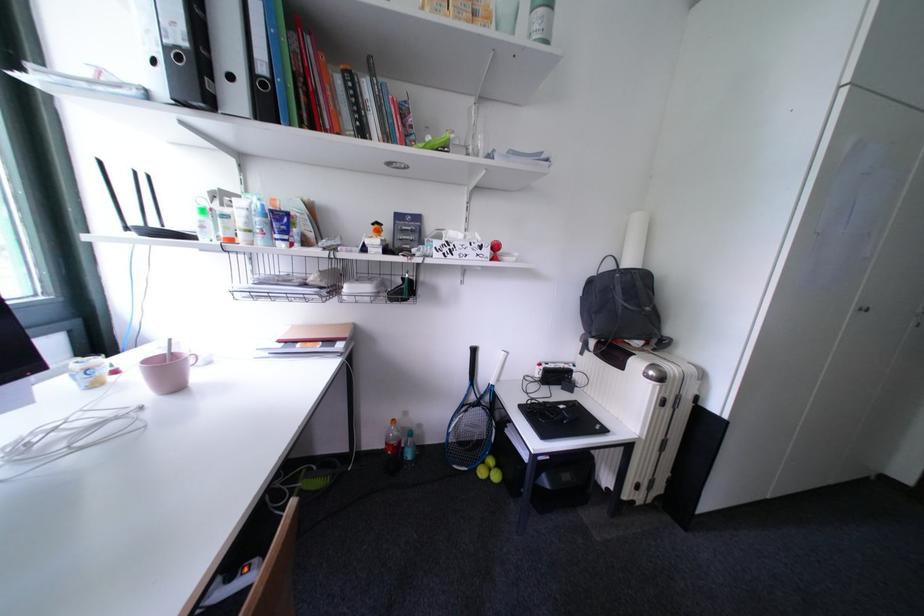
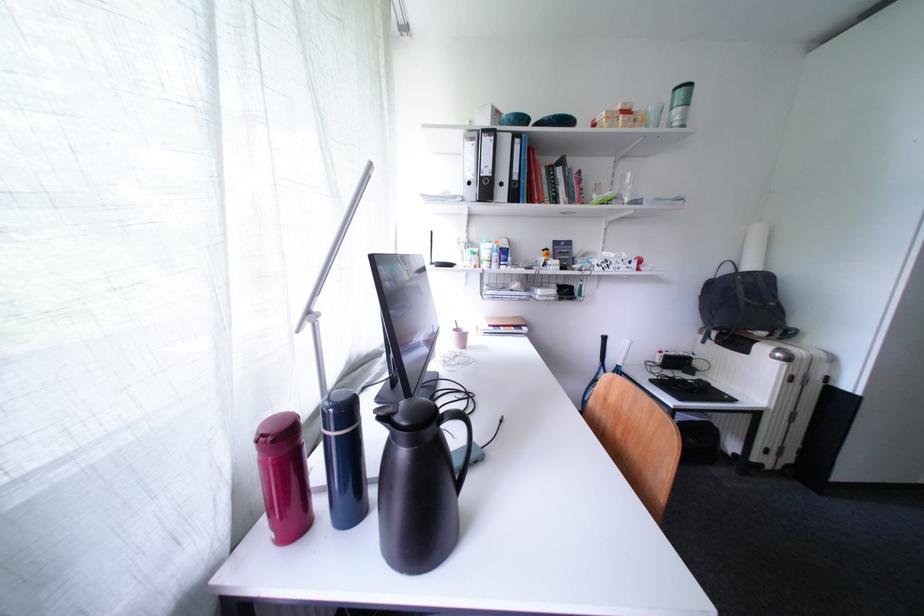
The images are taken continuously from a first-person perspective. In which direction are you moving?

The cameraman walked toward left, backward.